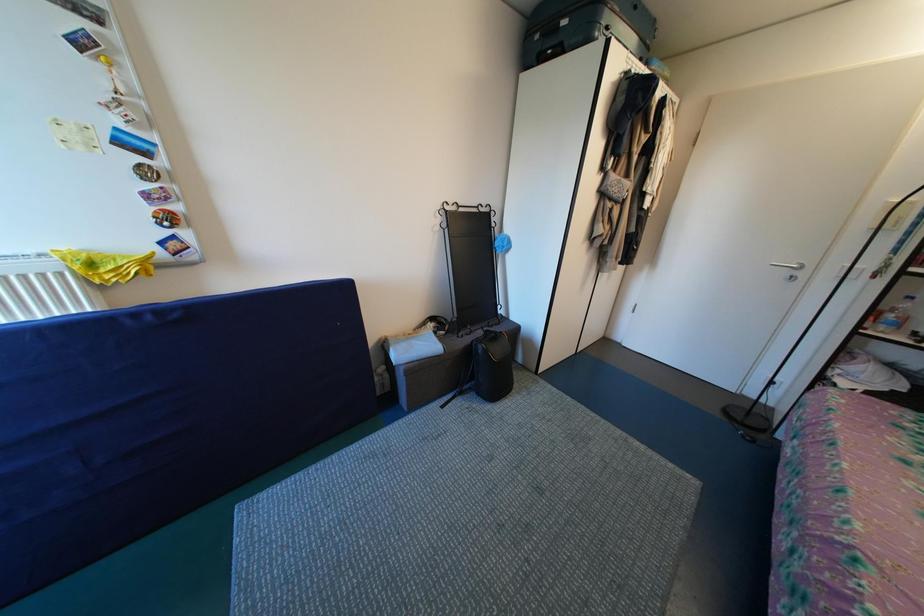
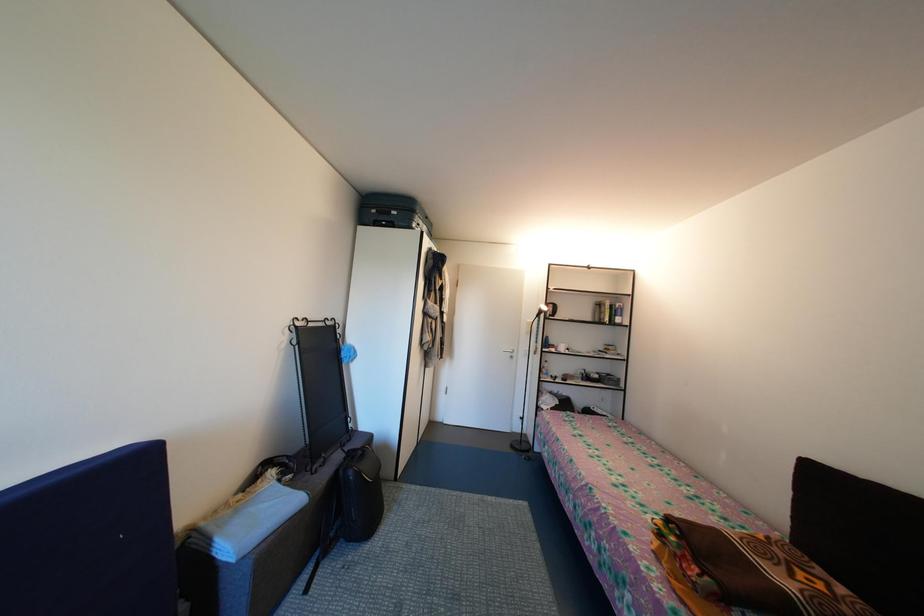
Based on the photo, the first image is from the beginning of the video and the second image is from the end. How did the camera likely rotate when shooting the video?

The rotation direction of the camera is right-up.